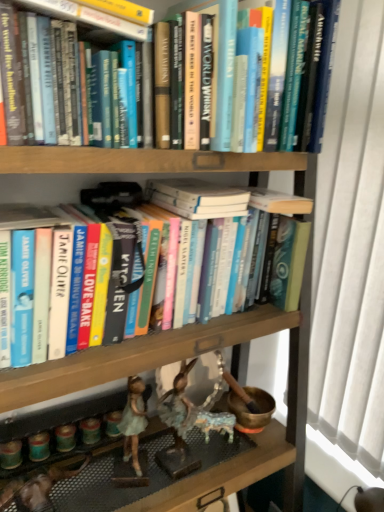
The height and width of the screenshot is (512, 384). In order to click on hardcover book at upper center, which appears as the 2th book when ordered from the bottom in this screenshot , I will do pyautogui.click(x=95, y=19).

At what (x,y) coordinates should I click in order to perform the action: click on white fabric at right. Please return your answer as a coordinate pair (x, y). Image resolution: width=384 pixels, height=512 pixels. Looking at the image, I should click on (349, 265).

How different are the orientations of hardcover book at upper center, arranged as the third book when ordered from the bottom, and hardcover book at upper center, the second book positioned from the top, in degrees?

The angle between the facing direction of hardcover book at upper center, arranged as the third book when ordered from the bottom, and the facing direction of hardcover book at upper center, the second book positioned from the top, is 0.00186 degrees.

Does hardcover book at upper center, which is counted as the first book, starting from the top, lie in front of hardcover book at upper center, the second book positioned from the top?

That is True.

Which of these two, hardcover book at upper center, which is counted as the first book, starting from the top, or hardcover book at upper center, the second book positioned from the top, is thinner?

Thinner between the two is hardcover book at upper center, the second book positioned from the top.

Can you see hardcover book at upper center, which is counted as the first book, starting from the top, touching hardcover book at upper center, the second book positioned from the top?

Yes, the surface of hardcover book at upper center, which is counted as the first book, starting from the top, is in contact with hardcover book at upper center, the second book positioned from the top.

Does point (45, 4) come behind point (357, 68)?

No, (45, 4) is closer to viewer.

Considering the positions of objects hardcover book at upper center, arranged as the third book when ordered from the bottom, and white fabric at right in the image provided, who is more to the right, hardcover book at upper center, arranged as the third book when ordered from the bottom, or white fabric at right?

Positioned to the right is white fabric at right.

Looking at the image, does hardcover book at upper center, arranged as the third book when ordered from the bottom, seem bigger or smaller compared to white fabric at right?

Considering their sizes, hardcover book at upper center, arranged as the third book when ordered from the bottom, takes up less space than white fabric at right.

Can you confirm if hardcover book at upper center, which is counted as the first book, starting from the top, is shorter than white fabric at right?

Yes, hardcover book at upper center, which is counted as the first book, starting from the top, is shorter than white fabric at right.

In the scene shown: From a real-world perspective, between hardcover book at upper center, the second book positioned from the top, and hardcover book at upper center, which is counted as the first book, starting from the top, who is vertically higher?

From a 3D spatial view, hardcover book at upper center, which is counted as the first book, starting from the top, is above.

Which of these two, hardcover book at upper center, the second book positioned from the top, or hardcover book at upper center, which is counted as the first book, starting from the top, is thinner?

hardcover book at upper center, the second book positioned from the top, is thinner.

Relative to hardcover book at upper center, which is counted as the first book, starting from the top, is hardcover book at upper center, the second book positioned from the top, in front or behind?

hardcover book at upper center, the second book positioned from the top, is behind hardcover book at upper center, which is counted as the first book, starting from the top.

From the image's perspective, is hardcover book at upper center, which appears as the 2th book when ordered from the bottom, located above hardcover book at upper center, which is counted as the first book, starting from the top?

No, from the image's perspective, hardcover book at upper center, which appears as the 2th book when ordered from the bottom, is not on top of hardcover book at upper center, which is counted as the first book, starting from the top.

Is hardcover book at upper center, which is counted as the first book, starting from the top, looking in the opposite direction of matte green figurine at lower left?

No, matte green figurine at lower left is not at the back of hardcover book at upper center, which is counted as the first book, starting from the top.

Is hardcover book at upper center, which is counted as the first book, starting from the top, inside the boundaries of matte green figurine at lower left, or outside?

hardcover book at upper center, which is counted as the first book, starting from the top, lies outside matte green figurine at lower left.

From a real-world perspective, which is physically below, hardcover book at upper center, arranged as the third book when ordered from the bottom, or matte green figurine at lower left?

matte green figurine at lower left is physically lower.

Which object is further away from the camera taking this photo, hardcover book at upper center, which is counted as the first book, starting from the top, or matte green figurine at lower left?

matte green figurine at lower left is behind.

Where is `person below the hardcover book at center, which is counted as the third book, starting from the top (from the image's perspective)`? Image resolution: width=384 pixels, height=512 pixels. person below the hardcover book at center, which is counted as the third book, starting from the top (from the image's perspective) is located at coordinates [133, 422].

From a real-world perspective, who is located lower, matte green figurine at lower left or hardcover book at center, which is counted as the third book, starting from the top?

matte green figurine at lower left, from a real-world perspective.

Is point (134, 466) positioned after point (300, 207)?

Yes, point (134, 466) is behind point (300, 207).

From the image's perspective, is matte green figurine at lower left on top of hardcover book at center, the first book from the bottom?

No, from the image's perspective, matte green figurine at lower left is not above hardcover book at center, the first book from the bottom.

Is hardcover book at center, which is counted as the third book, starting from the top, a part of hardcover book at upper center, which is counted as the first book, starting from the top?

No.

Is hardcover book at upper center, arranged as the third book when ordered from the bottom, facing towards hardcover book at center, which is counted as the third book, starting from the top?

No.

Considering the sizes of hardcover book at upper center, arranged as the third book when ordered from the bottom, and hardcover book at center, which is counted as the third book, starting from the top, in the image, is hardcover book at upper center, arranged as the third book when ordered from the bottom, wider or thinner than hardcover book at center, which is counted as the third book, starting from the top,?

Clearly, hardcover book at upper center, arranged as the third book when ordered from the bottom, has less width compared to hardcover book at center, which is counted as the third book, starting from the top.

Is point (97, 13) more distant than point (137, 396)?

That is False.

Can you confirm if hardcover book at upper center, the second book positioned from the top, is positioned to the right of matte green figurine at lower left?

No.

Between hardcover book at upper center, the second book positioned from the top, and matte green figurine at lower left, which one has less height?

Standing shorter between the two is hardcover book at upper center, the second book positioned from the top.

From a real-world perspective, which is physically above, hardcover book at upper center, the second book positioned from the top, or matte green figurine at lower left?

From a 3D spatial view, hardcover book at upper center, the second book positioned from the top, is above.

The image size is (384, 512). In order to click on book above the hardcover book at upper center, the second book positioned from the top (from a real-world perspective) in this screenshot , I will do `click(90, 17)`.

At what (x,y) coordinates should I click in order to perform the action: click on window screen below the hardcover book at upper center, which is counted as the first book, starting from the top (from a real-world perspective). Please return your answer as a coordinate pair (x, y). Looking at the image, I should click on (349, 265).

Based on their spatial positions, is hardcover book at upper center, which appears as the 2th book when ordered from the bottom, or matte green figurine at lower left further from hardcover book at upper center, which is counted as the first book, starting from the top?

The object further to hardcover book at upper center, which is counted as the first book, starting from the top, is matte green figurine at lower left.

Considering their positions, is hardcover book at upper center, which is counted as the first book, starting from the top, positioned closer to hardcover book at upper center, the second book positioned from the top, than white fabric at right?

Based on the image, hardcover book at upper center, which is counted as the first book, starting from the top, appears to be nearer to hardcover book at upper center, the second book positioned from the top.

From the image, which object appears to be farther from white fabric at right, matte green figurine at lower left or hardcover book at upper center, arranged as the third book when ordered from the bottom?

hardcover book at upper center, arranged as the third book when ordered from the bottom.

When comparing their distances from matte green figurine at lower left, does hardcover book at center, the first book from the bottom, or hardcover book at upper center, which appears as the 2th book when ordered from the bottom, seem closer?

hardcover book at center, the first book from the bottom, is closer to matte green figurine at lower left.

Which object lies further to the anchor point matte green figurine at lower left, white fabric at right or hardcover book at upper center, which is counted as the first book, starting from the top?

hardcover book at upper center, which is counted as the first book, starting from the top.

Considering their positions, is hardcover book at upper center, arranged as the third book when ordered from the bottom, positioned further to white fabric at right than hardcover book at upper center, which appears as the 2th book when ordered from the bottom?

Among the two, hardcover book at upper center, arranged as the third book when ordered from the bottom, is located further to white fabric at right.

Based on their spatial positions, is white fabric at right or hardcover book at center, which is counted as the third book, starting from the top, closer to hardcover book at upper center, which is counted as the first book, starting from the top?

hardcover book at center, which is counted as the third book, starting from the top, is closer to hardcover book at upper center, which is counted as the first book, starting from the top.

Looking at the image, which one is located closer to hardcover book at upper center, which is counted as the first book, starting from the top, matte green figurine at lower left or hardcover book at center, the first book from the bottom?

The object closer to hardcover book at upper center, which is counted as the first book, starting from the top, is hardcover book at center, the first book from the bottom.

Where is `window screen that lies between hardcover book at upper center, arranged as the third book when ordered from the bottom, and matte green figurine at lower left from top to bottom`? The width and height of the screenshot is (384, 512). window screen that lies between hardcover book at upper center, arranged as the third book when ordered from the bottom, and matte green figurine at lower left from top to bottom is located at coordinates (349, 265).

The width and height of the screenshot is (384, 512). I want to click on book between matte green figurine at lower left and white fabric at right in the horizontal direction, so click(x=147, y=273).

Where is `book between hardcover book at upper center, which appears as the 2th book when ordered from the bottom, and matte green figurine at lower left vertically`? book between hardcover book at upper center, which appears as the 2th book when ordered from the bottom, and matte green figurine at lower left vertically is located at coordinates pos(147,273).

The image size is (384, 512). In order to click on person between hardcover book at upper center, the second book positioned from the top, and white fabric at right, in the horizontal direction in this screenshot , I will do `click(133, 422)`.